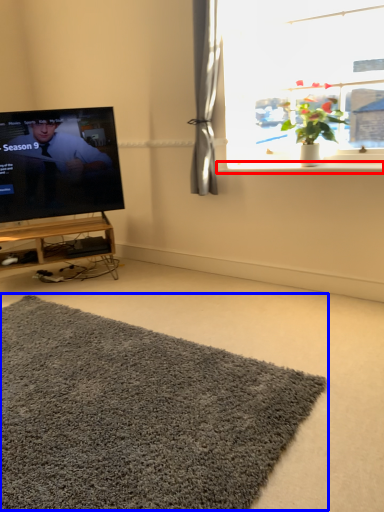
Question: Which object is further to the camera taking this photo, window sill (highlighted by a red box) or doormat (highlighted by a blue box)?

Choices:
 (A) window sill
 (B) doormat

Answer: (A)